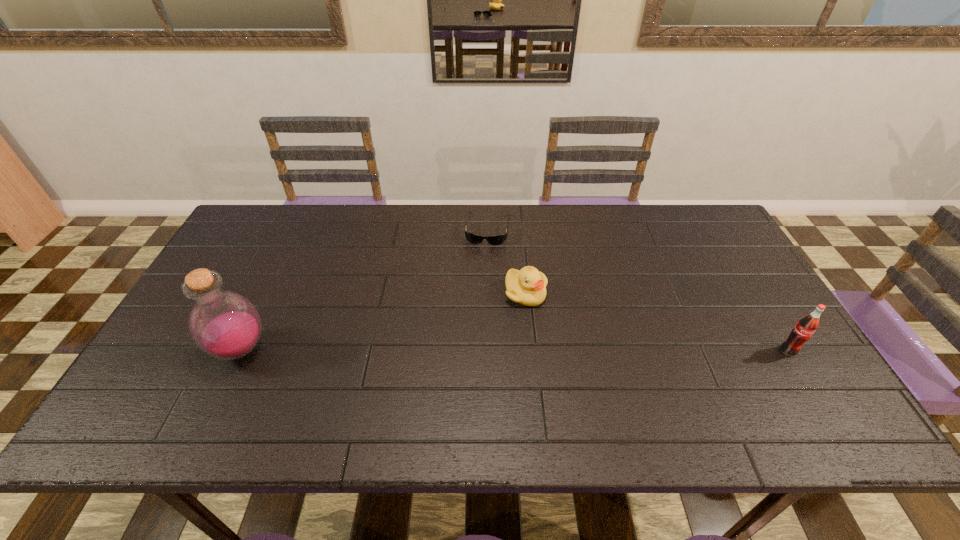
At what (x,y) coordinates should I click in order to perform the action: click on free space that satisfies the following two spatial constraints: 1. on the front side of the duckling; 2. on the right side of the sunglasses. Please return your answer as a coordinate pair (x, y). Image resolution: width=960 pixels, height=540 pixels. Looking at the image, I should click on (490, 293).

You are a GUI agent. You are given a task and a screenshot of the screen. Output one action in this format:
    pyautogui.click(x=<x>, y=<y>)
    Task: Click on the vacant region that satisfies the following two spatial constraints: 1. on the back side of the leftmost object; 2. on the left side of the second shortest object
    The image size is (960, 540).
    Given the screenshot: What is the action you would take?
    pyautogui.click(x=268, y=293)